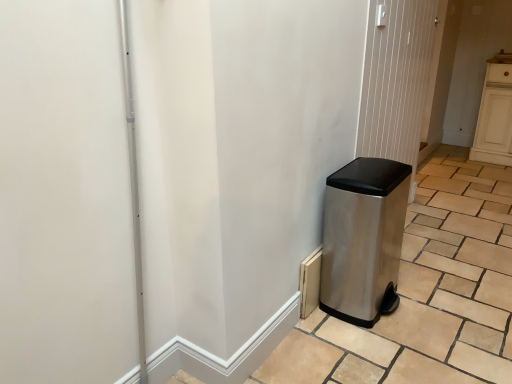
Image resolution: width=512 pixels, height=384 pixels. What are the coordinates of `free space in front of stainless steel trash can at right` in the screenshot? It's located at (431, 289).